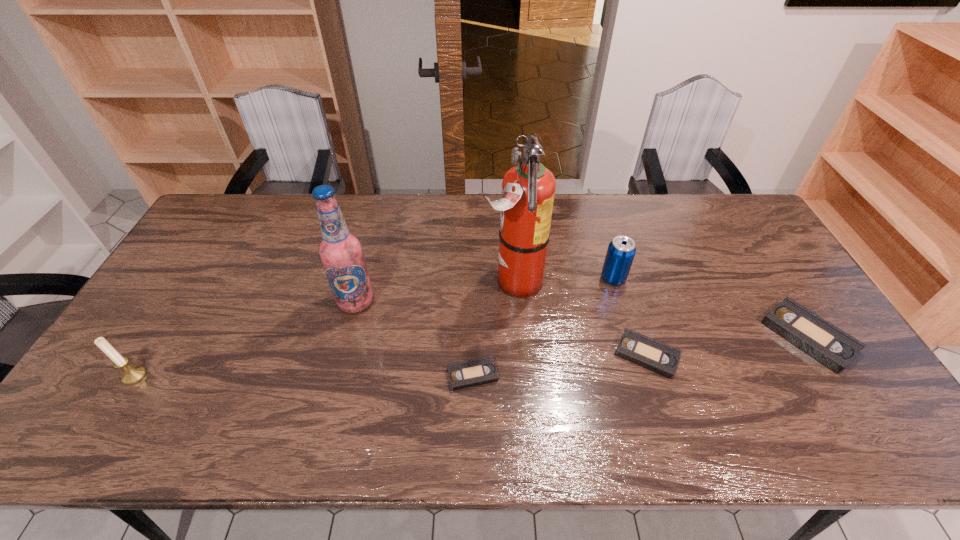
This screenshot has width=960, height=540. Find the location of `the shortest object`. the shortest object is located at coordinates (465, 374).

Where is `the leftmost videotape`? the leftmost videotape is located at coordinates (465, 374).

Where is `the second videotape from left to right`? This screenshot has height=540, width=960. the second videotape from left to right is located at coordinates (654, 355).

Find the location of a particular element. The height and width of the screenshot is (540, 960). the second tallest videotape is located at coordinates (654, 355).

Identify the location of the tallest videotape. The width and height of the screenshot is (960, 540). 828,344.

Find the location of a particular element. The height and width of the screenshot is (540, 960). the rightmost videotape is located at coordinates (828, 344).

Locate an element on the screen. This screenshot has height=540, width=960. fire extinguisher is located at coordinates 528,188.

This screenshot has width=960, height=540. Identify the location of pop soda. (621, 251).

The image size is (960, 540). Identify the location of candle holder. (132, 374).

Where is `alcohol`? The height and width of the screenshot is (540, 960). alcohol is located at coordinates (341, 253).